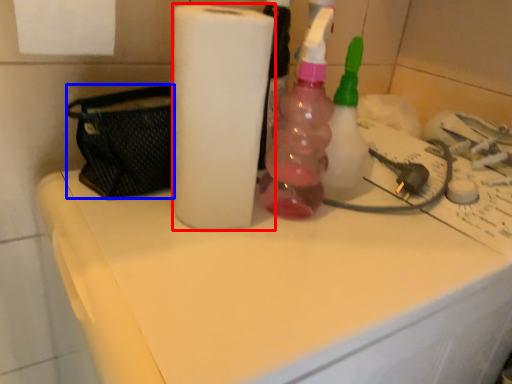
Question: Among these objects, which one is farthest to the camera, paper towel (highlighted by a red box) or pouch (highlighted by a blue box)?

Choices:
 (A) paper towel
 (B) pouch

Answer: (B)